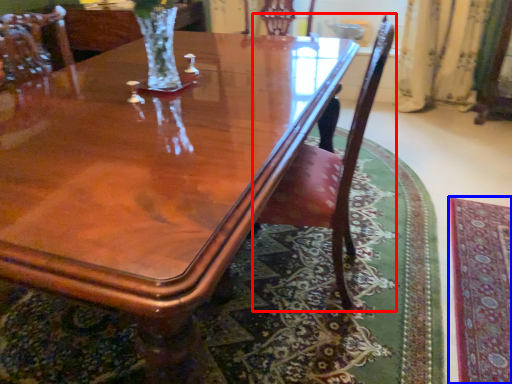
Question: Which object appears closest to the camera in this image, chair (highlighted by a red box) or mat (highlighted by a blue box)?

Choices:
 (A) chair
 (B) mat

Answer: (A)